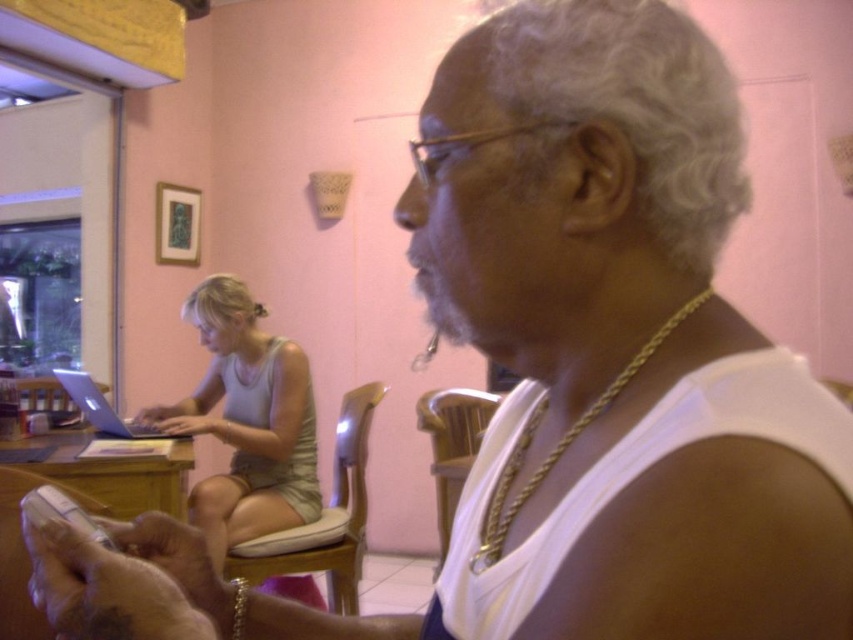
From the picture: You are standing in the room and want to find the light purple tank top at center. According to the scene description, where should you look to locate it?

The light purple tank top at center is located at point (247, 420), so you should look towards the coordinates 0.659 on the x axis and 0.290 on the y axis to find it.

You are an interior designer assessing the color coordination in the room. The light purple tank top at center and the matte purple laptop at left are both purple, but you need to determine which one is more dominant in the scene. Which object takes up more visual space?

The light purple tank top at center takes up more visual space because it is larger in size than the matte purple laptop at left.